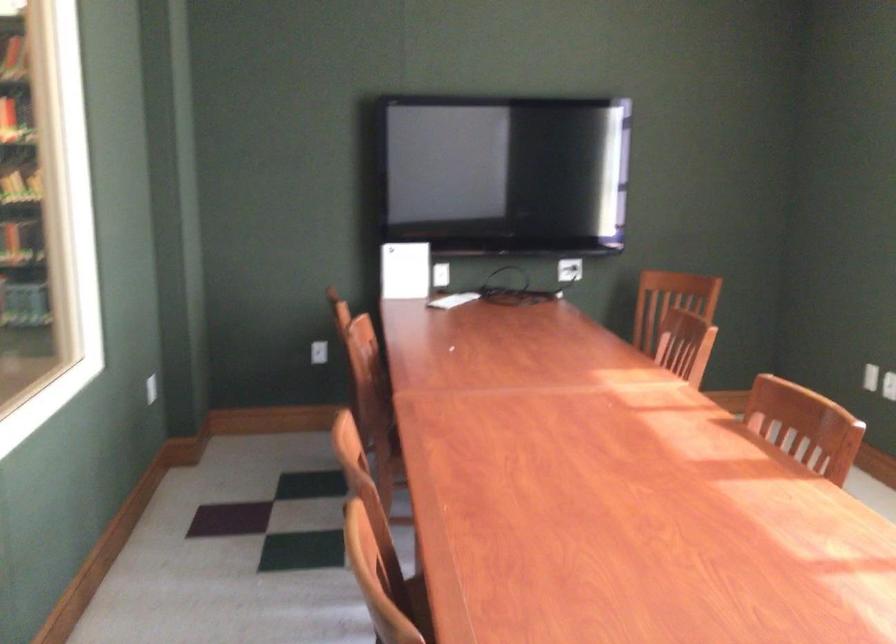
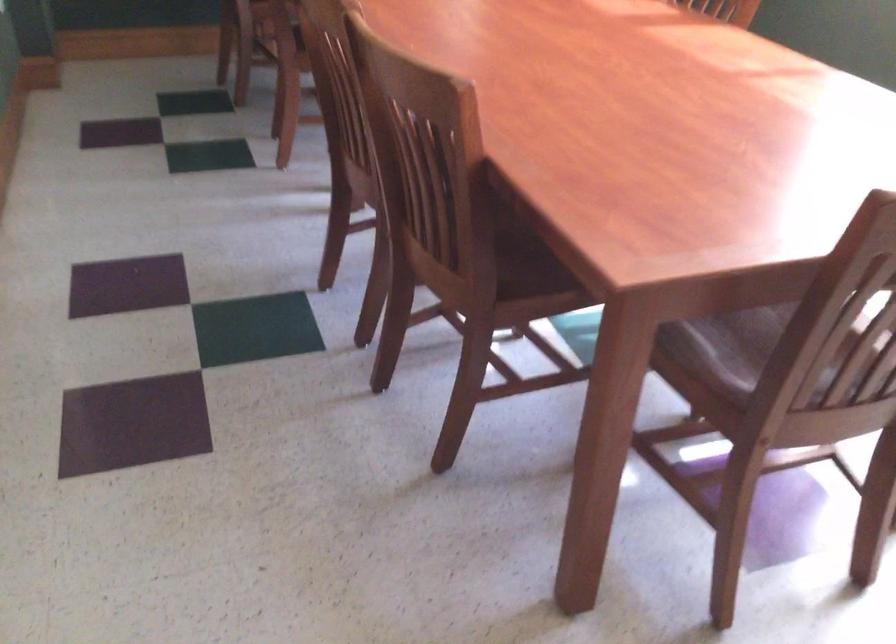
Looking at this image, in a continuous first-person perspective shot, in which direction is the camera moving?

The cameraman walked toward left, backward.